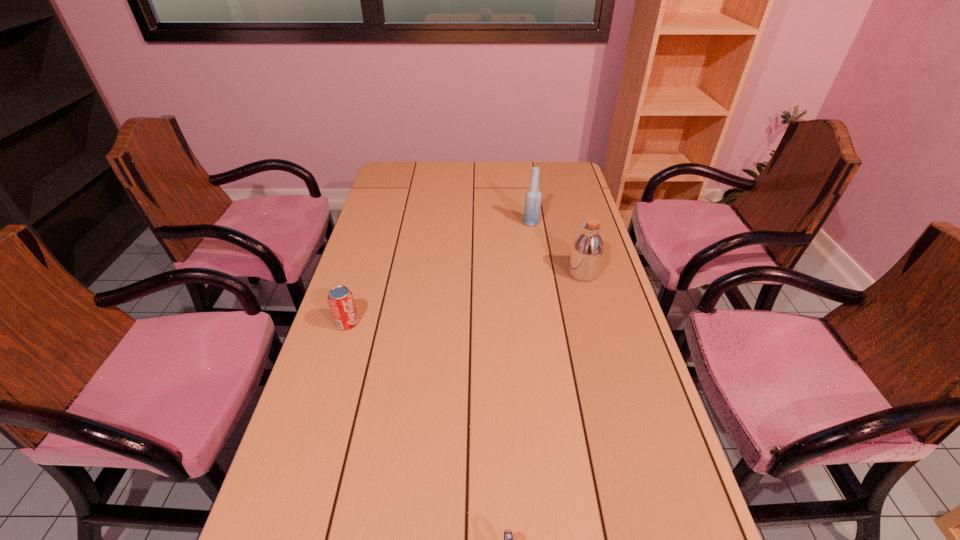
Where is `object at the right edge`? This screenshot has width=960, height=540. object at the right edge is located at coordinates (587, 249).

This screenshot has width=960, height=540. What are the coordinates of `vacant space at the far edge` in the screenshot? It's located at [x=518, y=179].

Where is `vacant space at the left edge`? The height and width of the screenshot is (540, 960). vacant space at the left edge is located at coordinates (364, 291).

The height and width of the screenshot is (540, 960). Identify the location of free space at the right edge of the desktop. (x=557, y=239).

The image size is (960, 540). Identify the location of free space at the far left corner. (409, 186).

Locate an element on the screen. The width and height of the screenshot is (960, 540). vacant space at the far right corner of the desktop is located at coordinates (555, 168).

Locate an element on the screen. This screenshot has height=540, width=960. vacant area that lies between the second nearest object and the rightmost object is located at coordinates (465, 298).

Where is `empty space between the nearer bottle and the leftmost object`? This screenshot has width=960, height=540. empty space between the nearer bottle and the leftmost object is located at coordinates (465, 298).

Find the location of `vacant area between the nearer bottle and the soda can`. vacant area between the nearer bottle and the soda can is located at coordinates (465, 298).

Where is `vacant area that lies between the second nearest object and the farther bottle`? This screenshot has width=960, height=540. vacant area that lies between the second nearest object and the farther bottle is located at coordinates (440, 273).